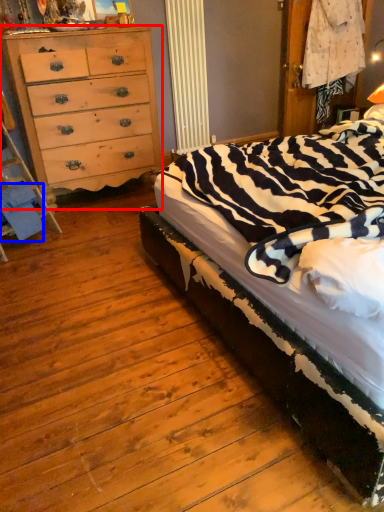
Question: Which object is further to the camera taking this photo, chest of drawers (highlighted by a red box) or material (highlighted by a blue box)?

Choices:
 (A) chest of drawers
 (B) material

Answer: (A)